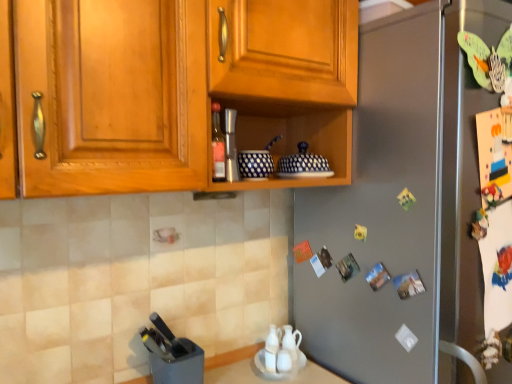
Question: Is brushed metal shaker at center, placed as the second appliance when sorted from left to right, wider than blue dotted ceramic bowls at center, which is the 2th appliance from top to bottom?

Choices:
 (A) yes
 (B) no

Answer: (B)

Question: From a real-world perspective, is brushed metal shaker at center, marked as the third appliance in a bottom-to-top arrangement, under blue dotted ceramic bowls at center, which ranks as the second appliance in bottom-to-top order?

Choices:
 (A) no
 (B) yes

Answer: (A)

Question: Could you tell me if brushed metal shaker at center, arranged as the 2th appliance when viewed from the right, is turned towards blue dotted ceramic bowls at center, which is the 2th appliance from top to bottom?

Choices:
 (A) yes
 (B) no

Answer: (B)

Question: Can you confirm if brushed metal shaker at center, arranged as the 2th appliance when viewed from the right, is smaller than blue dotted ceramic bowls at center, the 1th appliance positioned from the right?

Choices:
 (A) yes
 (B) no

Answer: (A)

Question: Can you confirm if brushed metal shaker at center, the first appliance positioned from the top, is thinner than blue dotted ceramic bowls at center, the 3th appliance positioned from the left?

Choices:
 (A) yes
 (B) no

Answer: (A)

Question: Is brushed metal shaker at center, marked as the third appliance in a bottom-to-top arrangement, at the left side of blue dotted ceramic bowls at center, which ranks as the second appliance in bottom-to-top order?

Choices:
 (A) yes
 (B) no

Answer: (A)

Question: Is wooden cabinet at upper center thinner than brushed metal shaker at center, placed as the second appliance when sorted from left to right?

Choices:
 (A) no
 (B) yes

Answer: (A)

Question: From the image's perspective, is wooden cabinet at upper center below brushed metal shaker at center, the first appliance positioned from the top?

Choices:
 (A) yes
 (B) no

Answer: (B)

Question: Would you consider wooden cabinet at upper center to be distant from brushed metal shaker at center, the first appliance positioned from the top?

Choices:
 (A) no
 (B) yes

Answer: (A)

Question: Considering the relative sizes of wooden cabinet at upper center and brushed metal shaker at center, placed as the second appliance when sorted from left to right, in the image provided, is wooden cabinet at upper center smaller than brushed metal shaker at center, placed as the second appliance when sorted from left to right,?

Choices:
 (A) no
 (B) yes

Answer: (A)

Question: Considering the relative positions of wooden cabinet at upper center and brushed metal shaker at center, arranged as the 2th appliance when viewed from the right, in the image provided, is wooden cabinet at upper center to the right of brushed metal shaker at center, arranged as the 2th appliance when viewed from the right, from the viewer's perspective?

Choices:
 (A) yes
 (B) no

Answer: (A)

Question: From the image's perspective, is wooden cabinet at upper center above brushed metal shaker at center, arranged as the 2th appliance when viewed from the right?

Choices:
 (A) yes
 (B) no

Answer: (A)

Question: Is black plastic knife block at lower left, arranged as the first appliance when viewed from the left, outside blue dotted ceramic bowls at center, the 3th appliance positioned from the left?

Choices:
 (A) yes
 (B) no

Answer: (A)